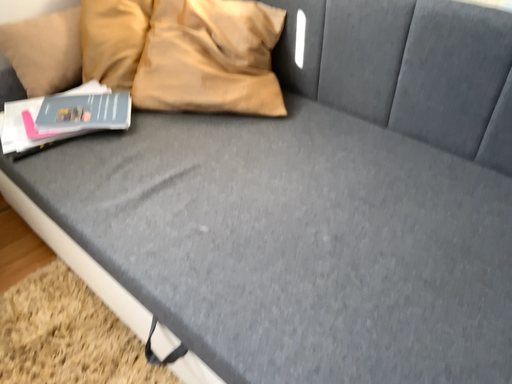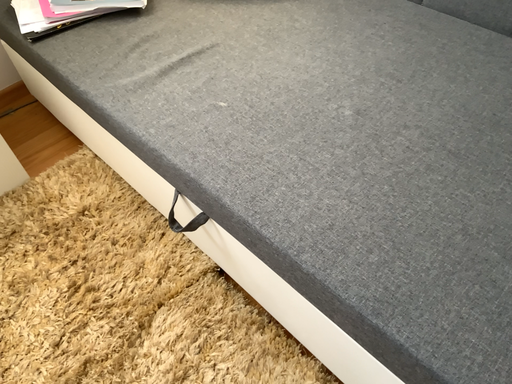
Question: How did the camera likely rotate when shooting the video?

Choices:
 (A) rotated upward
 (B) rotated downward

Answer: (B)